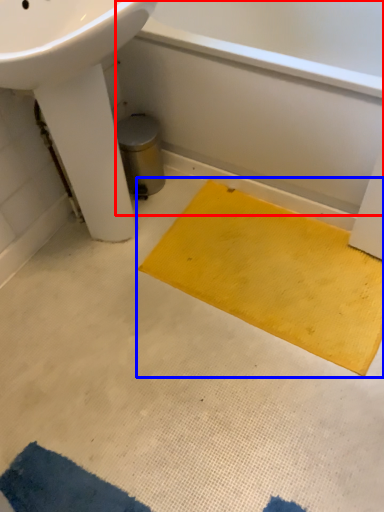
Question: Which object is further to the camera taking this photo, bath (highlighted by a red box) or doormat (highlighted by a blue box)?

Choices:
 (A) bath
 (B) doormat

Answer: (B)